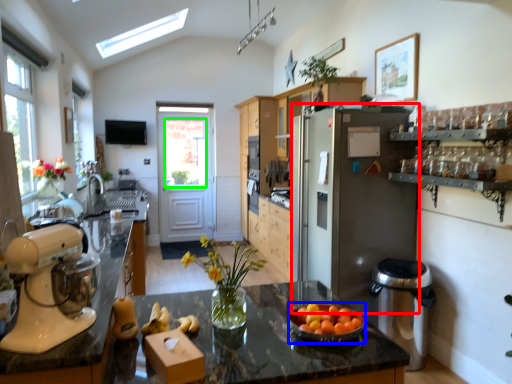
Question: Which is farther away from refrigerator (highlighted by a red box)? tableware (highlighted by a blue box) or window screen (highlighted by a green box)?

Choices:
 (A) tableware
 (B) window screen

Answer: (B)